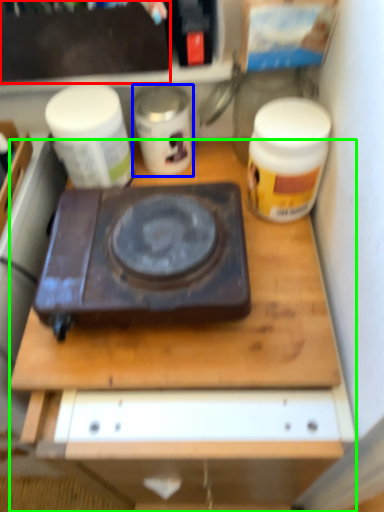
Question: Which object is positioned farthest from box (highlighted by a red box)? Select from yoghurt (highlighted by a blue box) and desk (highlighted by a green box).

Choices:
 (A) yoghurt
 (B) desk

Answer: (B)